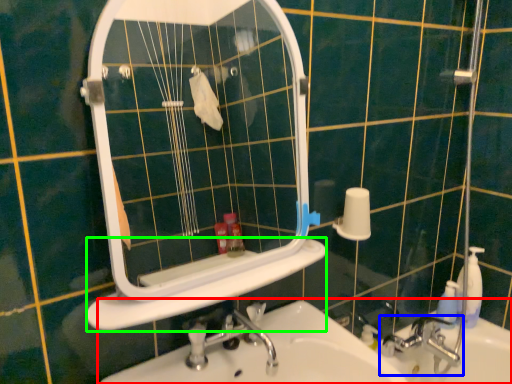
Question: Which object is positioned closest to sink (highlighted by a red box)? Select from tap (highlighted by a blue box) and ledge (highlighted by a green box).

Choices:
 (A) tap
 (B) ledge

Answer: (B)